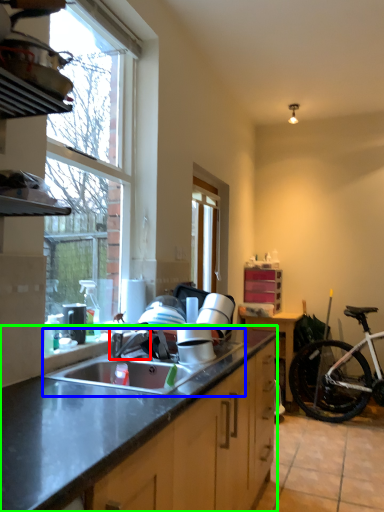
Question: Which object is the farthest from faucet (highlighted by a red box)? Choose among these: sink (highlighted by a blue box) or countertop (highlighted by a green box).

Choices:
 (A) sink
 (B) countertop

Answer: (B)